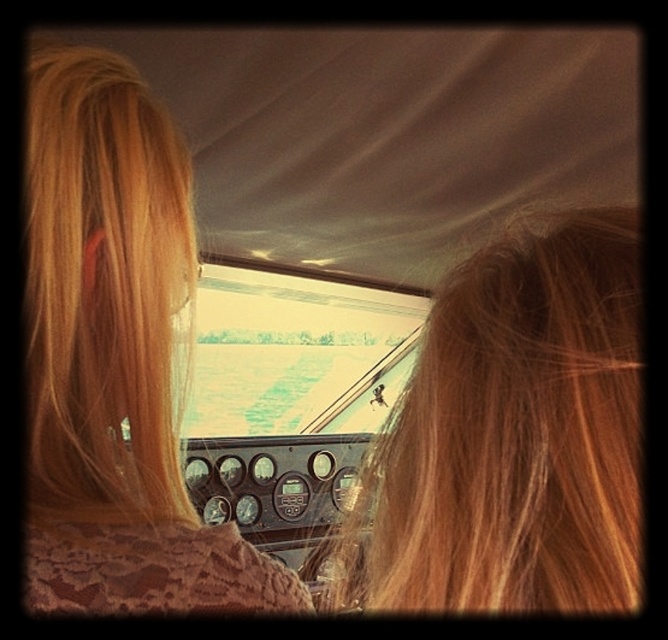
Who is positioned more to the right, blonde hair at center or blonde hair at left?

Positioned to the right is blonde hair at center.

Locate an element on the screen. blonde hair at center is located at coordinates (512, 436).

From the picture: Who is more distant from viewer, [532,579] or [120,77]?

Positioned behind is point [120,77].

Locate an element on the screen. This screenshot has height=640, width=668. blonde hair at center is located at coordinates (512, 436).